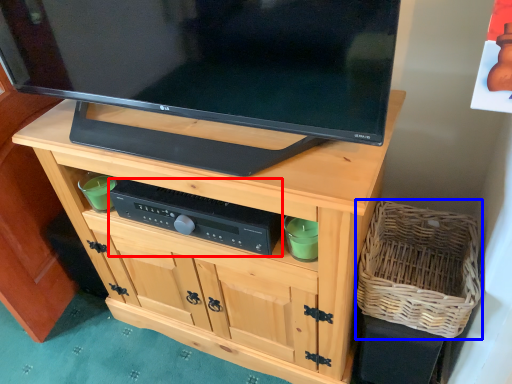
Question: Which object appears closest to the camera in this image, control (highlighted by a red box) or basket (highlighted by a blue box)?

Choices:
 (A) control
 (B) basket

Answer: (B)